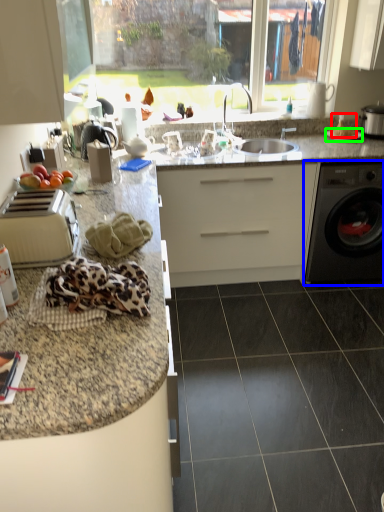
Question: Which object is positioned closest to food (highlighted by a red box)? Select from washing machine (highlighted by a blue box) and gas stove (highlighted by a green box).

Choices:
 (A) washing machine
 (B) gas stove

Answer: (B)